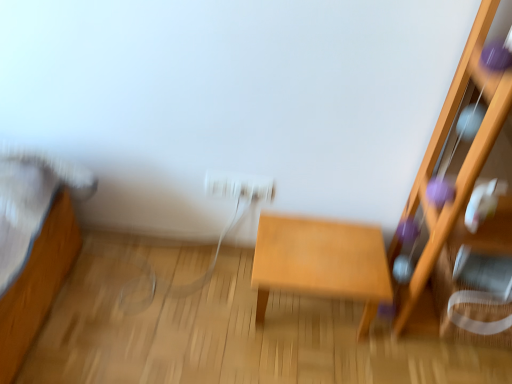
Identify the location of vacant area that lies in front of light brown wooden table at center. This screenshot has width=512, height=384. click(307, 362).